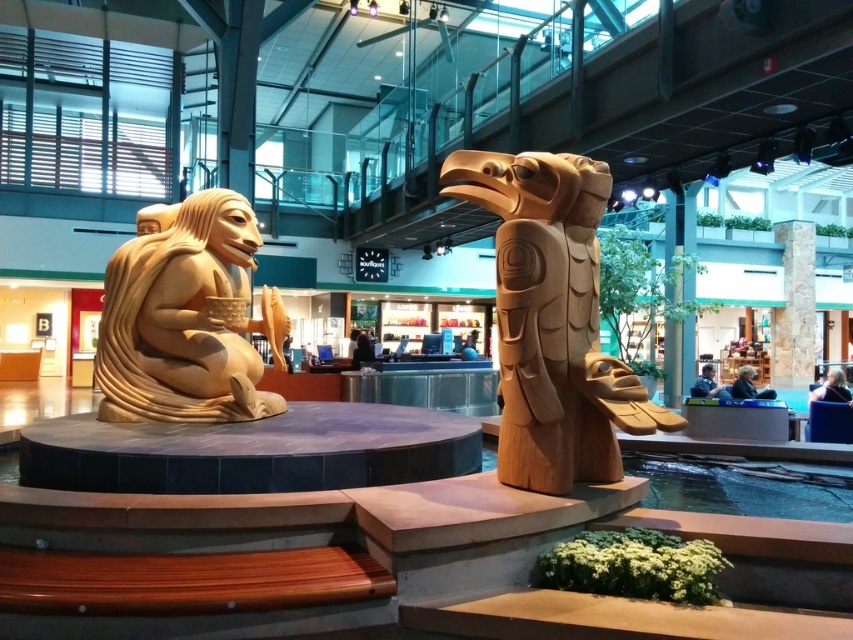
You are standing in the shopping mall and see the wooden carving at left. Can you tell me where the point at coordinates (186, 320) is located?

The point at coordinates (186, 320) is located on the wooden carving at left.